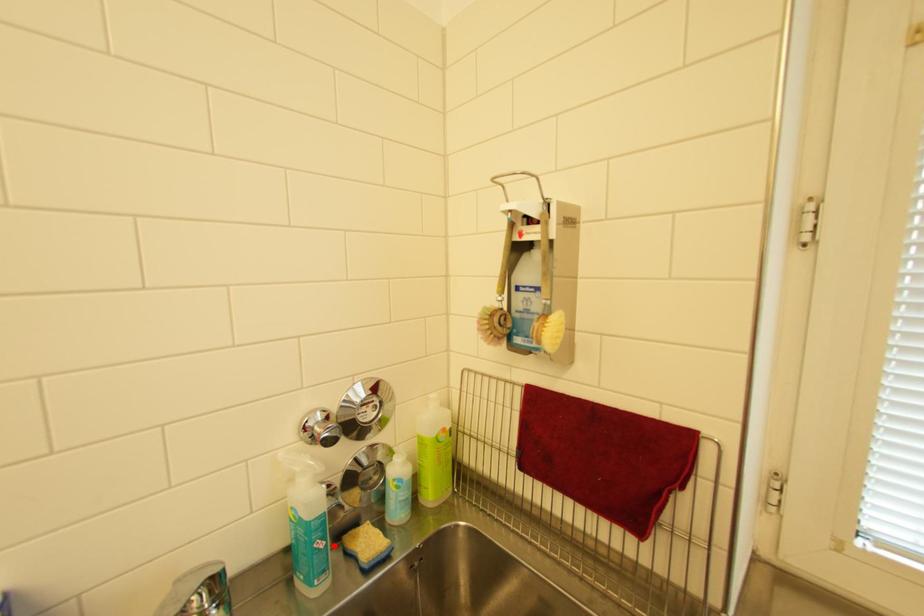
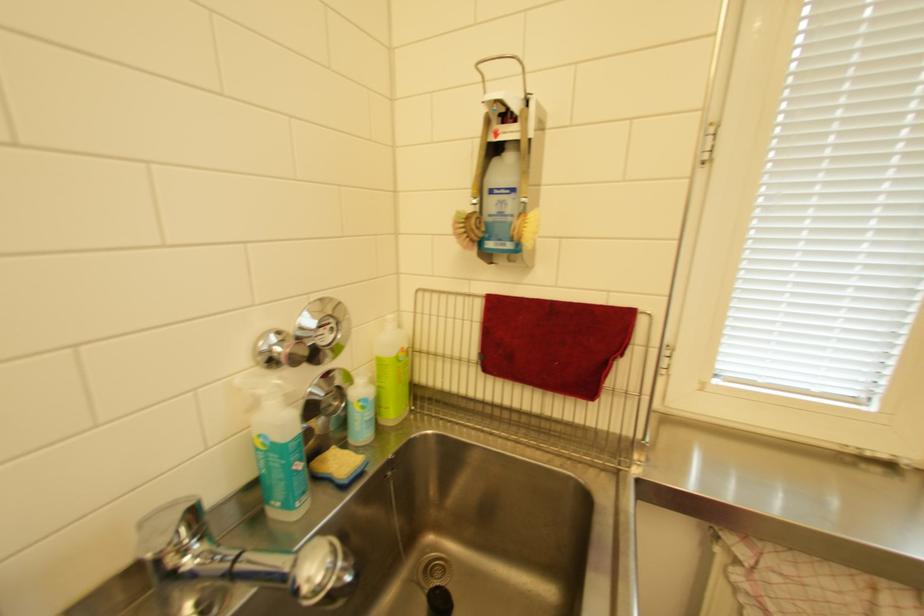
Find the pixel in the second image that matches the highlighted location in the first image.

(312, 467)